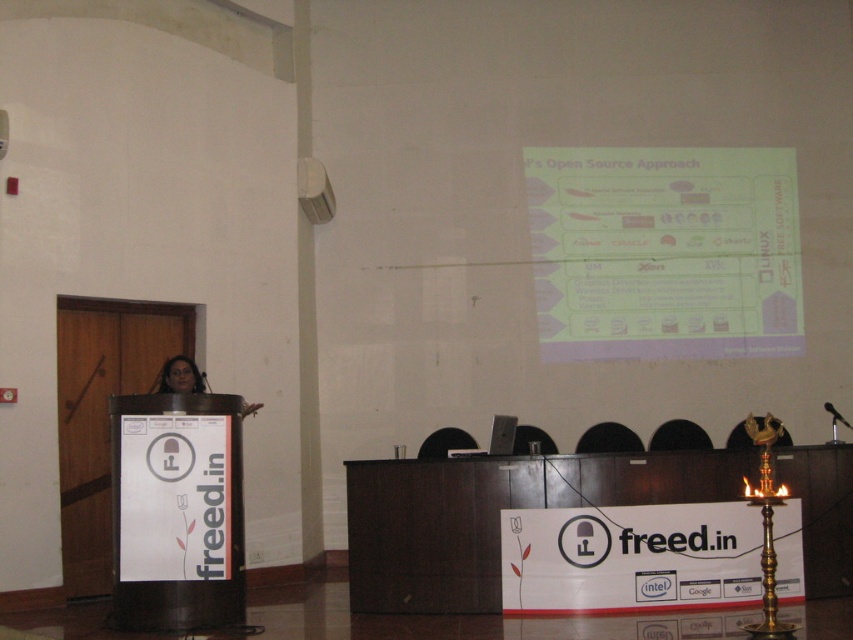
Between white paper at upper center and matte black woman at center, which one appears on the right side from the viewer's perspective?

white paper at upper center is more to the right.

Does white paper at upper center appear on the left side of matte black woman at center?

In fact, white paper at upper center is to the right of matte black woman at center.

Measure the distance between white paper at upper center and camera.

white paper at upper center is 35.88 feet away from camera.

The width and height of the screenshot is (853, 640). Find the location of `white paper at upper center`. white paper at upper center is located at coordinates (664, 252).